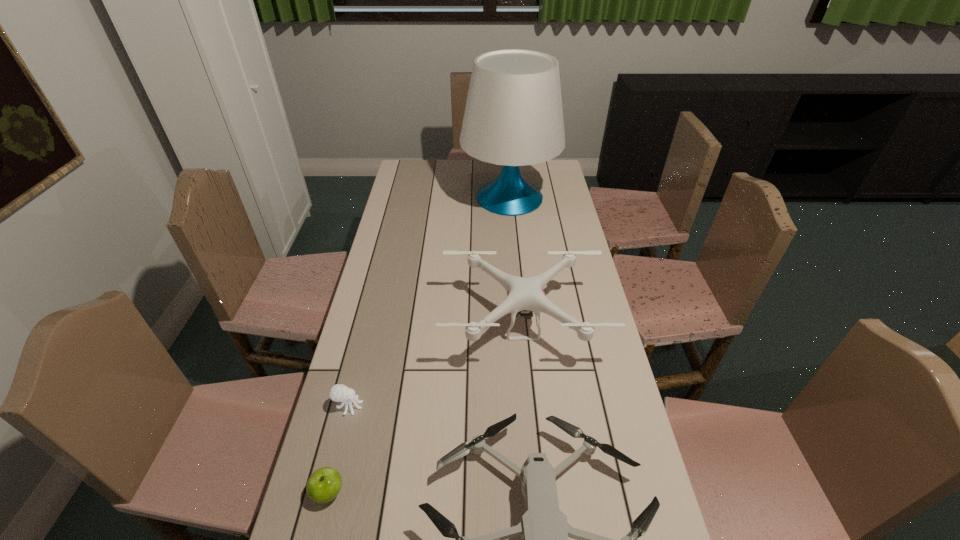
Locate an element on the screen. The width and height of the screenshot is (960, 540). table lamp is located at coordinates (513, 117).

I want to click on the tallest object, so (x=513, y=117).

Locate an element on the screen. The image size is (960, 540). the farther drone is located at coordinates (523, 293).

At what (x,y) coordinates should I click in order to perform the action: click on the fourth nearest object. Please return your answer as a coordinate pair (x, y). Looking at the image, I should click on (523, 293).

Image resolution: width=960 pixels, height=540 pixels. I want to click on apple, so click(324, 484).

Find the location of a particular element. octopus is located at coordinates (339, 393).

Find the location of a particular element. This screenshot has height=540, width=960. vacant area situated 0.170m on the front-facing side of the farthest object is located at coordinates (423, 198).

This screenshot has width=960, height=540. I want to click on vacant region located on the front-facing side of the farthest object, so click(423, 198).

Where is `vacant space located 0.230m on the front-facing side of the farthest object`? The height and width of the screenshot is (540, 960). vacant space located 0.230m on the front-facing side of the farthest object is located at coordinates (410, 198).

The height and width of the screenshot is (540, 960). I want to click on blank space located on the top of the second farthest object, so click(x=530, y=404).